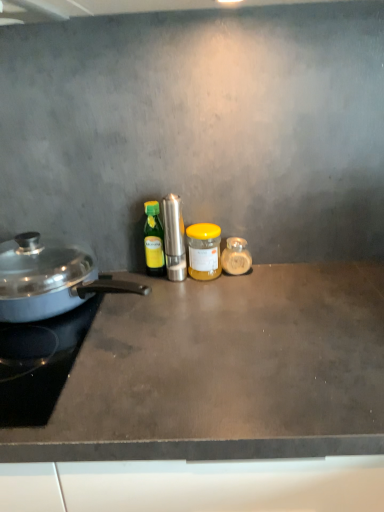
Locate an element on the screen. The width and height of the screenshot is (384, 512). blank space situated above black glass gas stove at left (from a real-world perspective) is located at coordinates pos(36,343).